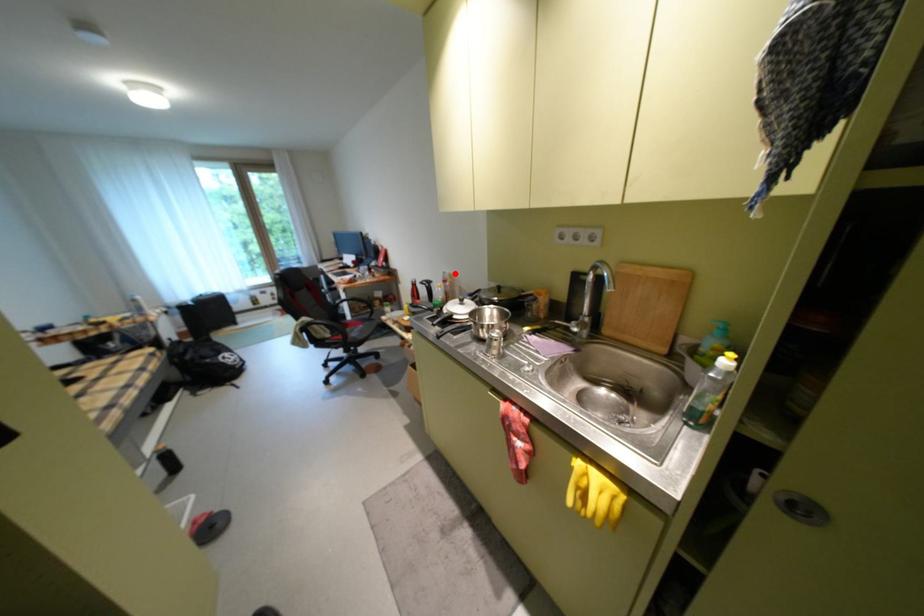
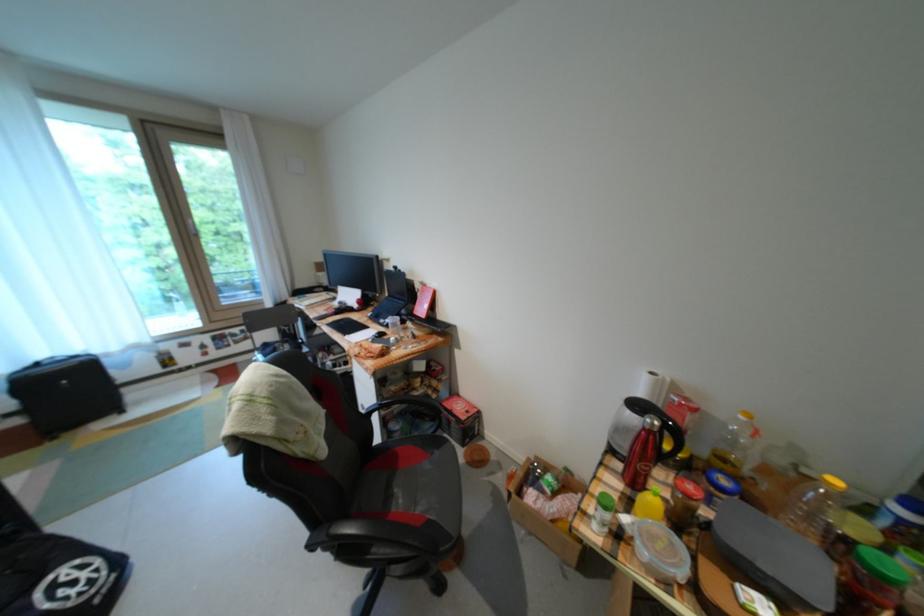
Question: I am providing you with two images of the same scene from different viewpoints. A red point is marked on the first image. Is the red point's position out of view in image 2?

Choices:
 (A) Yes
 (B) No

Answer: (B)